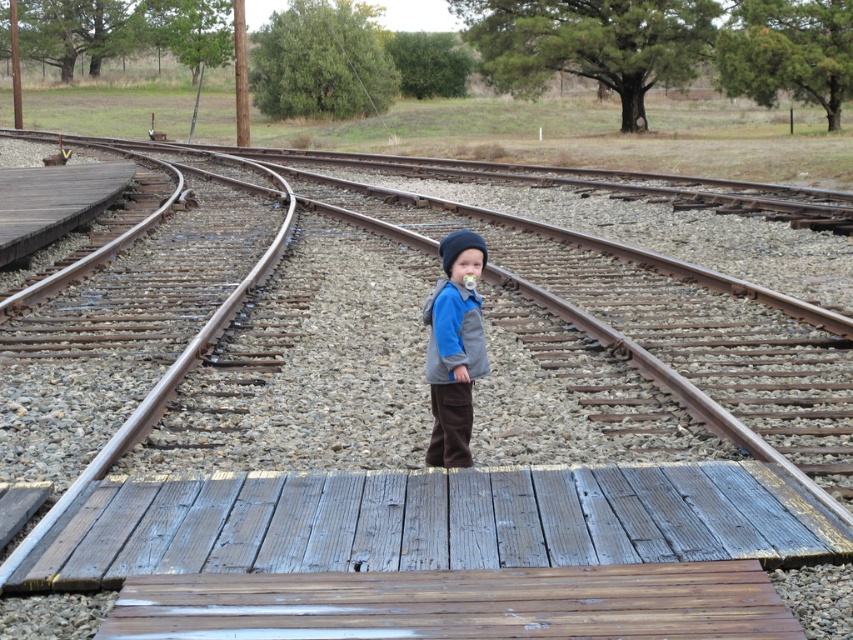
You are a parent trying to ensure your child stays safe near the rusty metal track at center and the brown suede vest at center. Which object is closer to the ground?

The brown suede vest at center is closer to the ground because the rusty metal track at center is located above it.

You are a parent trying to ensure your child stays safe while playing near the rusty metal track at center and the brown suede vest at center. Which object is higher and could pose a tripping hazard?

The rusty metal track at center is taller than the brown suede vest at center, so it poses a higher tripping hazard.